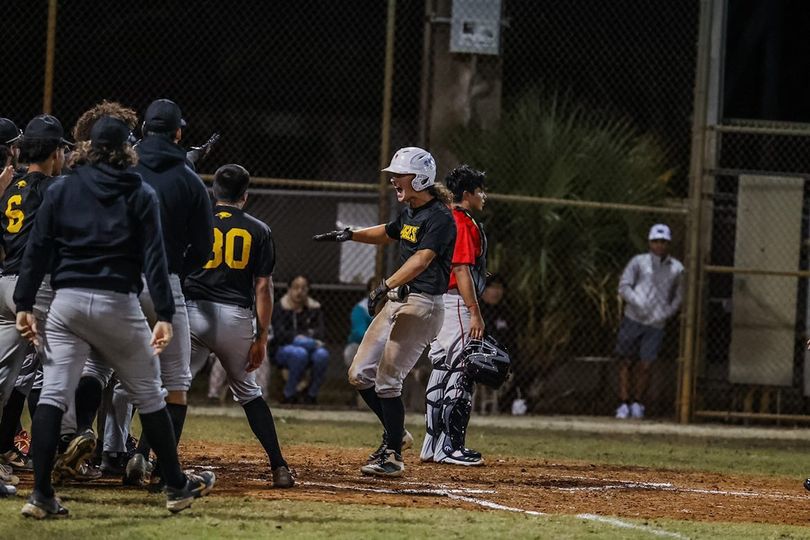
The width and height of the screenshot is (810, 540). I want to click on shoe, so click(x=197, y=487), click(x=288, y=471), click(x=381, y=461), click(x=75, y=450).